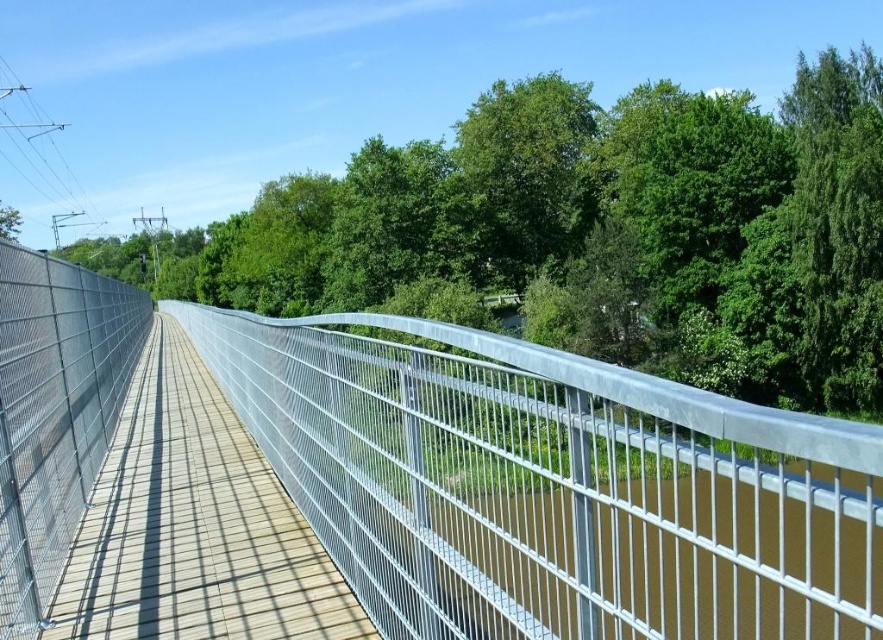
Question: Is silver metallic fence at center closer to the viewer compared to green leafy tree at upper center?

Choices:
 (A) yes
 (B) no

Answer: (A)

Question: Which of the following is the farthest from the observer?

Choices:
 (A) click(155, 609)
 (B) click(502, 182)
 (C) click(523, 593)

Answer: (B)

Question: Among these points, which one is nearest to the camera?

Choices:
 (A) pyautogui.click(x=142, y=348)
 (B) pyautogui.click(x=308, y=276)

Answer: (A)

Question: Where is silver metallic fence at center located in relation to wooden planks at center in the image?

Choices:
 (A) left
 (B) right

Answer: (B)

Question: Which point is closer to the camera?

Choices:
 (A) silver metallic fence at center
 (B) wooden planks at center

Answer: (A)

Question: Considering the relative positions of green leafy tree at upper center and wooden planks at center in the image provided, where is green leafy tree at upper center located with respect to wooden planks at center?

Choices:
 (A) below
 (B) above

Answer: (B)